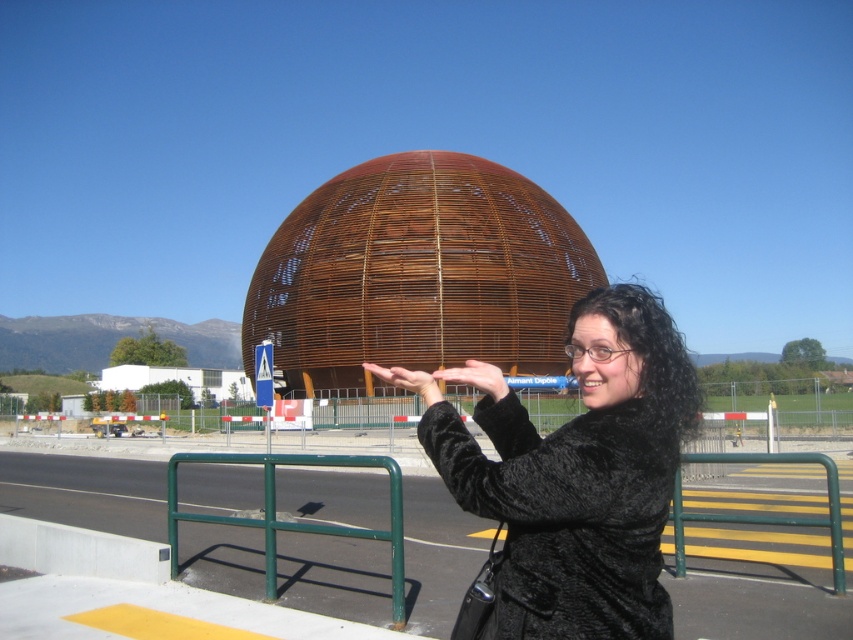
Is point (393, 269) less distant than point (610, 456)?

No, (393, 269) is further to viewer.

Is rustic wood dome at center further to camera compared to black fur coat at center?

That is True.

Find the location of `rustic wood dome at center`. rustic wood dome at center is located at coordinates (416, 273).

I want to click on rustic wood dome at center, so click(x=416, y=273).